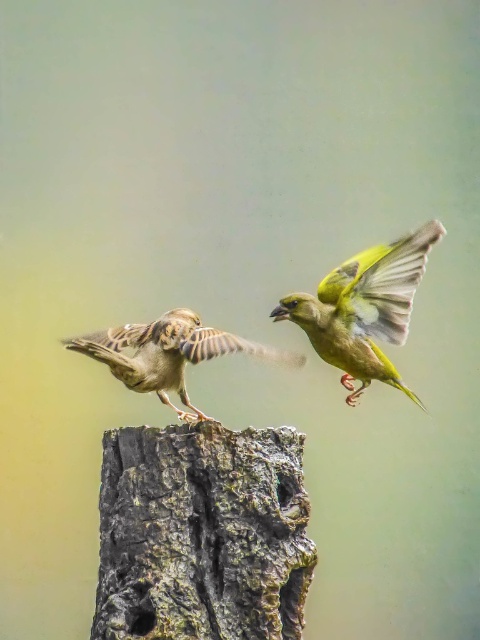
Which is more to the right, rough bark tree trunk at center or brown speckled sparrow at center?

From the viewer's perspective, rough bark tree trunk at center appears more on the right side.

This screenshot has height=640, width=480. Find the location of `rough bark tree trunk at center`. rough bark tree trunk at center is located at coordinates (202, 532).

Between point (288, 316) and point (223, 353), which one is positioned in front?

Positioned in front is point (223, 353).

Between point (310, 316) and point (166, 380), which one is positioned in front?

Point (166, 380)

Where is `green glossy bird at center`? Image resolution: width=480 pixels, height=640 pixels. green glossy bird at center is located at coordinates (364, 308).

Can you confirm if rough bark tree trunk at center is bigger than green glossy bird at center?

A: Incorrect, rough bark tree trunk at center is not larger than green glossy bird at center.

Describe the element at coordinates (202, 532) in the screenshot. This screenshot has height=640, width=480. I see `rough bark tree trunk at center` at that location.

Is point (191, 593) closer to camera compared to point (407, 392)?

Yes, it is.

The image size is (480, 640). I want to click on rough bark tree trunk at center, so click(x=202, y=532).